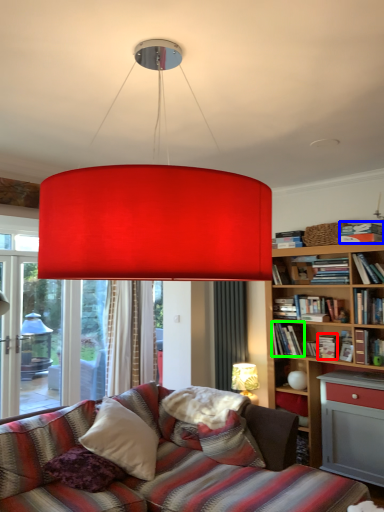
Question: Based on their relative distances, which object is farther from book (highlighted by a red box)? Choose from book (highlighted by a blue box) and book (highlighted by a green box).

Choices:
 (A) book
 (B) book

Answer: (A)